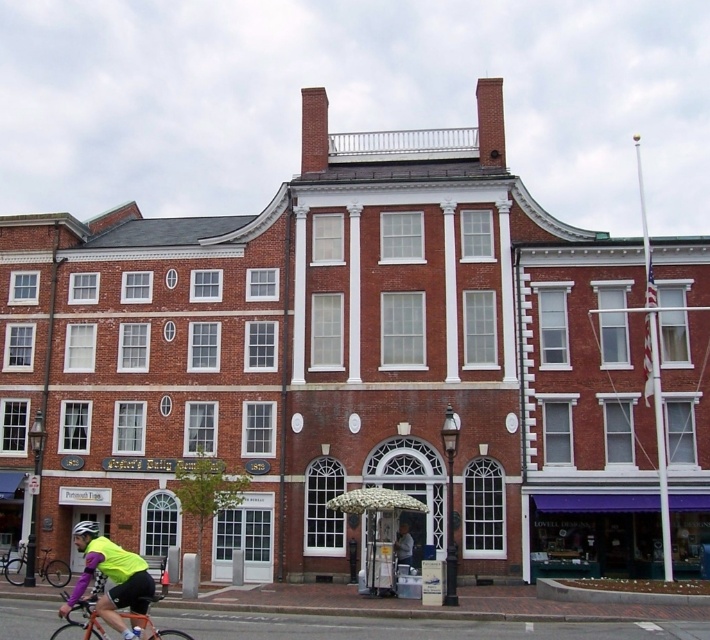
In the scene shown: Who is higher up, orange matte bicycle at lower left or black matte bicycle at lower left?

orange matte bicycle at lower left is above.

The width and height of the screenshot is (710, 640). In order to click on orange matte bicycle at lower left in this screenshot , I will do `click(84, 618)`.

The height and width of the screenshot is (640, 710). In order to click on orange matte bicycle at lower left in this screenshot , I will do (x=84, y=618).

Who is positioned more to the right, neon yellow jersey at lower left or white matte bicycle helmet at center?

neon yellow jersey at lower left is more to the right.

Who is more forward, (147, 634) or (94, 531)?

Point (147, 634)

Which is behind, point (65, 612) or point (81, 529)?

The point (81, 529) is more distant.

Locate an element on the screen. The image size is (710, 640). neon yellow jersey at lower left is located at coordinates (114, 582).

Between orange matte bicycle at lower left and white matte bicycle helmet at center, which one appears on the right side from the viewer's perspective?

orange matte bicycle at lower left

How far apart are orange matte bicycle at lower left and white matte bicycle helmet at center?

orange matte bicycle at lower left is 5.87 meters from white matte bicycle helmet at center.

What do you see at coordinates (84, 618) in the screenshot? Image resolution: width=710 pixels, height=640 pixels. I see `orange matte bicycle at lower left` at bounding box center [84, 618].

The width and height of the screenshot is (710, 640). What are the coordinates of `orange matte bicycle at lower left` in the screenshot? It's located at (84, 618).